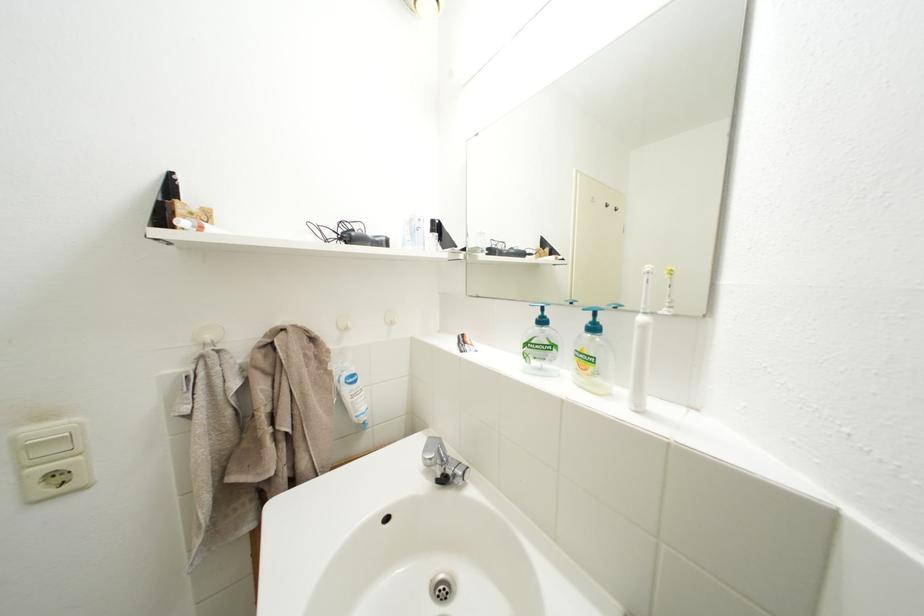
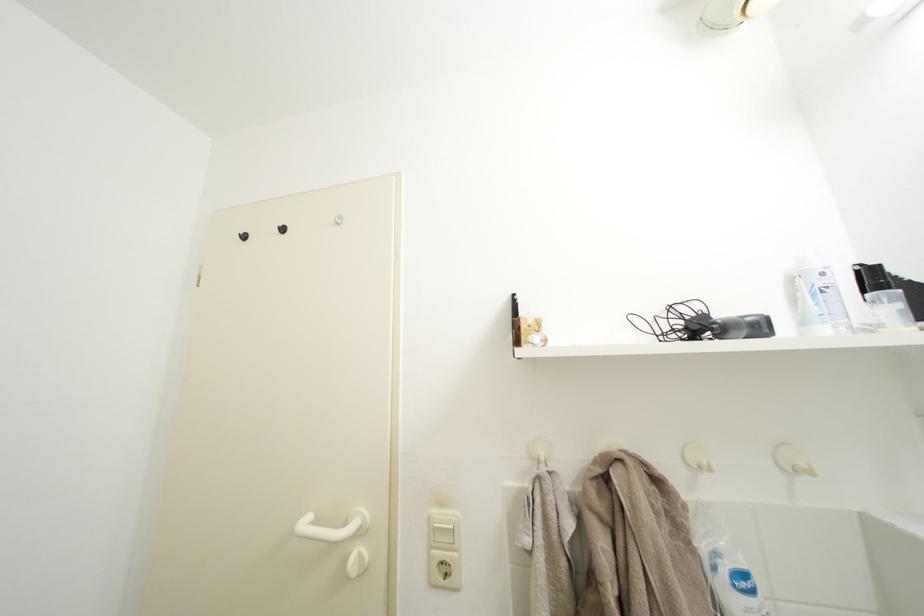
First-person continuous shooting, in which direction is the camera rotating?

The camera's rotation is toward left-up.